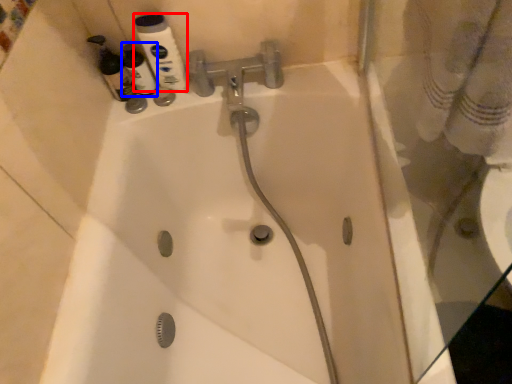
Question: Which point is further to the camera, mouthwash (highlighted by a red box) or cleaning product (highlighted by a blue box)?

Choices:
 (A) mouthwash
 (B) cleaning product

Answer: (B)